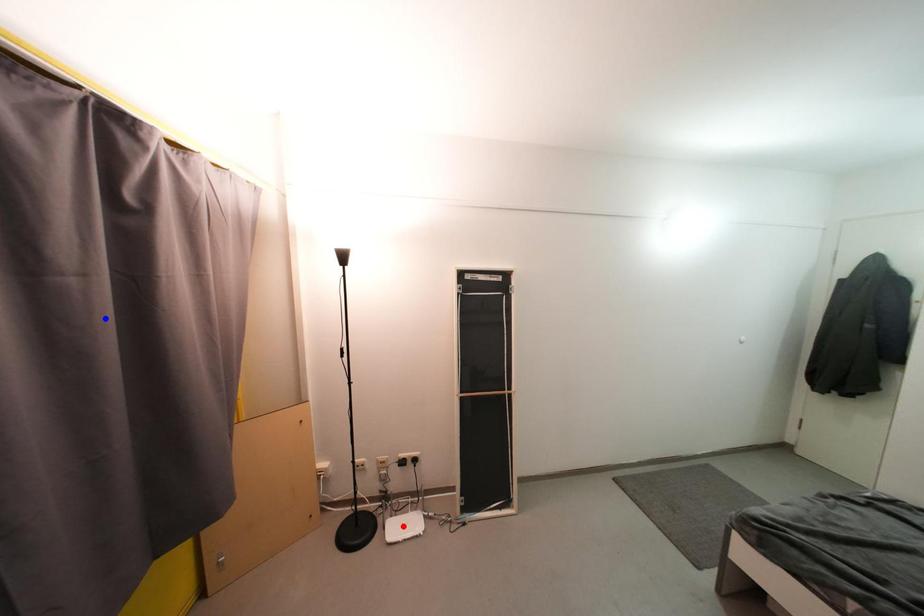
Question: Which of the two points in the image is closer to the camera?

Choices:
 (A) Blue point is closer.
 (B) Red point is closer.

Answer: (A)